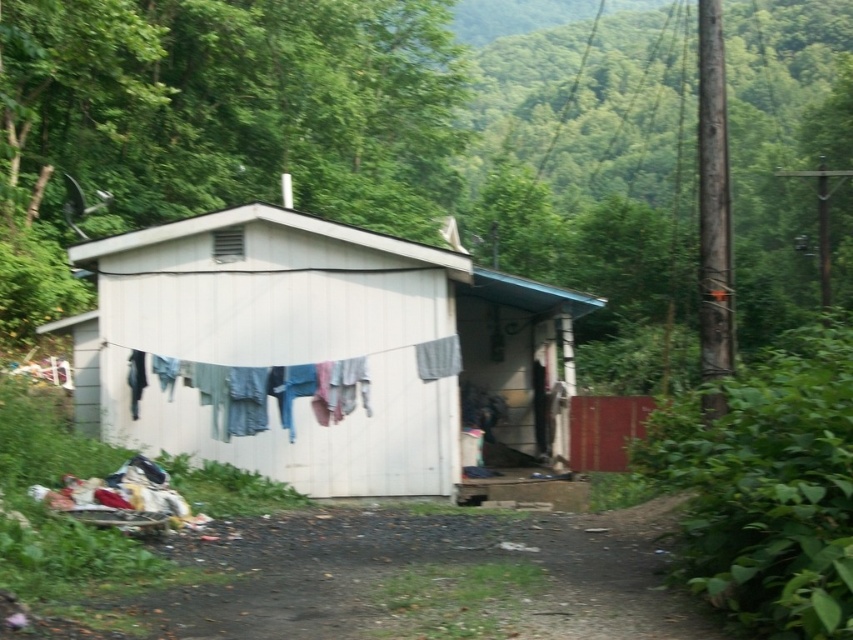
Between white corrugated metal hut at center and washed cotton clothes at center, which one has less height?

white corrugated metal hut at center

Describe the element at coordinates (317, 349) in the screenshot. I see `white corrugated metal hut at center` at that location.

This screenshot has height=640, width=853. Identify the location of white corrugated metal hut at center. (317, 349).